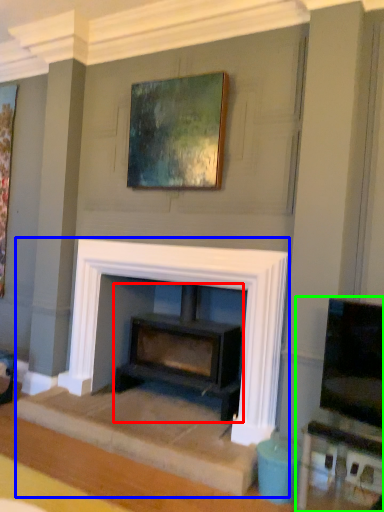
Question: Which object is positioned closest to wood burning stove (highlighted by a red box)? Select from fireplace (highlighted by a blue box) and entertainment center (highlighted by a green box).

Choices:
 (A) fireplace
 (B) entertainment center

Answer: (A)